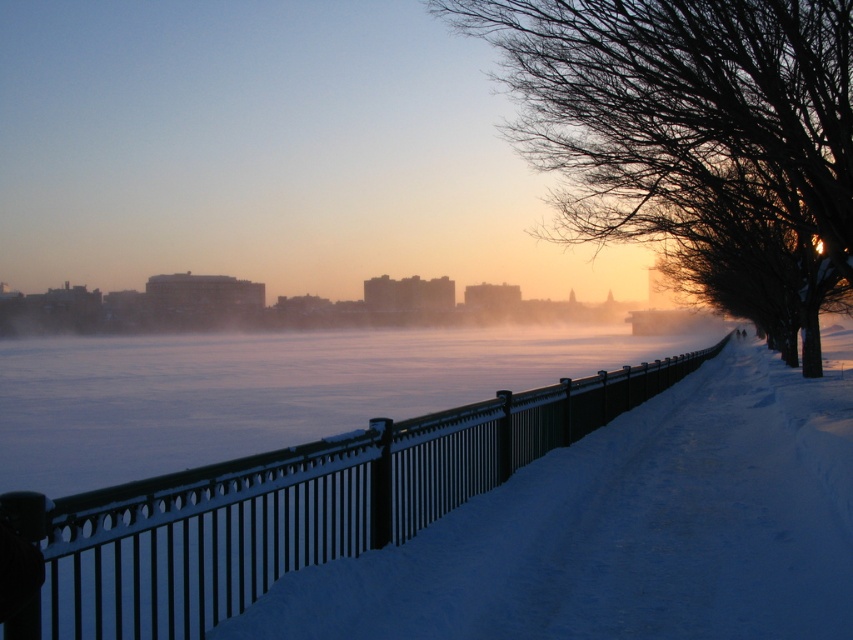
Question: Is bare branches at upper right to the left of black metal fence at center from the viewer's perspective?

Choices:
 (A) yes
 (B) no

Answer: (B)

Question: Where is bare branches at upper right located in relation to black metal fence at center in the image?

Choices:
 (A) right
 (B) left

Answer: (A)

Question: Does bare branches at upper right appear over black metal fence at center?

Choices:
 (A) yes
 (B) no

Answer: (A)

Question: Which point is closer to the camera?

Choices:
 (A) (264, 480)
 (B) (691, 154)

Answer: (A)

Question: Among these points, which one is farthest from the camera?

Choices:
 (A) (817, 38)
 (B) (253, 480)

Answer: (A)